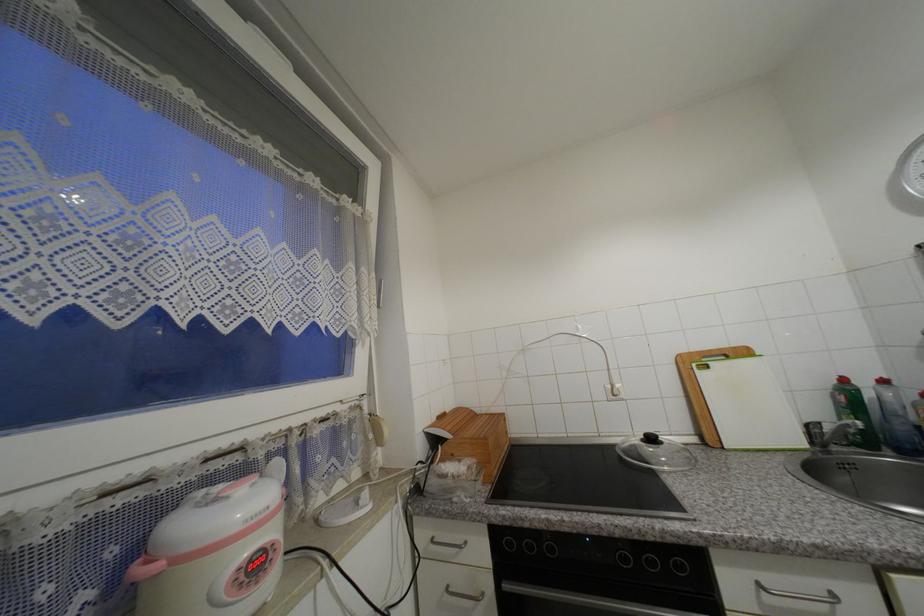
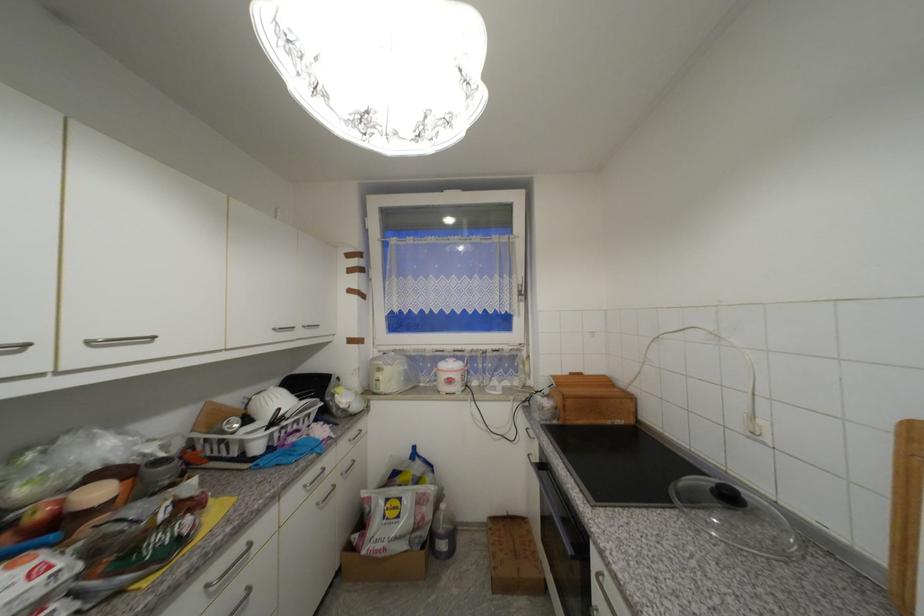
The point at (440, 419) is marked in the first image. Where is the corresponding point in the second image?

(572, 374)